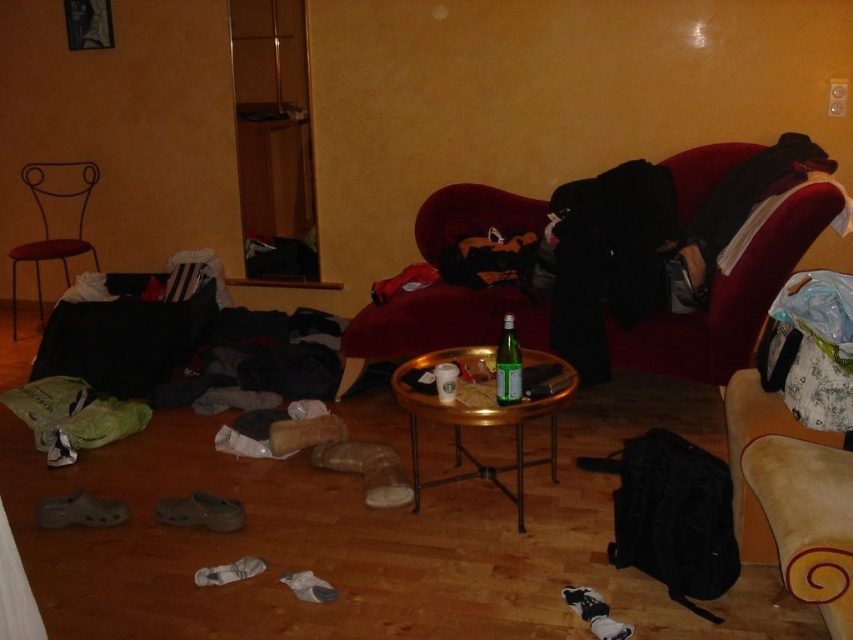
You are trying to rearrange the living room and want to place a new rectangular side table between the velvet red couch at center and the green glass bottle at center. Given that the side table requires 2 feet of space, can you fit it there?

The velvet red couch at center is wider than the green glass bottle at center, but the exact distance between them isn

You are standing in the living room and want to place a new decorative item on the gold metallic table at center. Based on its current position, where exactly should you aim to place it?

The gold metallic table at center is located at coordinates point (482,419), so you should aim for that specific point to place the decorative item.

You are trying to move a large rectangular box from the entrance to the back wall of the living room. The velvet red couch at center and the gold metallic table at center are in your path. Based on their sizes, which object might block your path more if the box is wider than the table?

The velvet red couch at center might block the path more than the gold metallic table at center since the velvet red couch at center is wider according to the description.